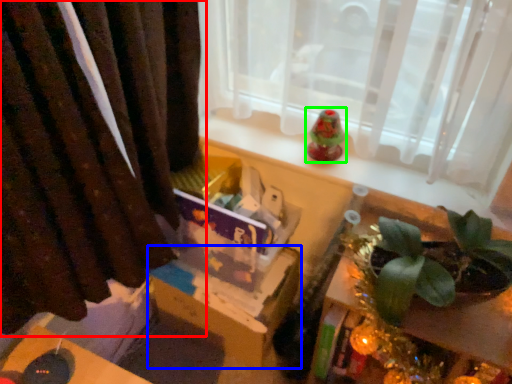
Question: Estimate the real-world distances between objects in this image. Which object is closer to curtain (highlighted by a red box), cardboard box (highlighted by a blue box) or toy (highlighted by a green box)?

Choices:
 (A) cardboard box
 (B) toy

Answer: (A)